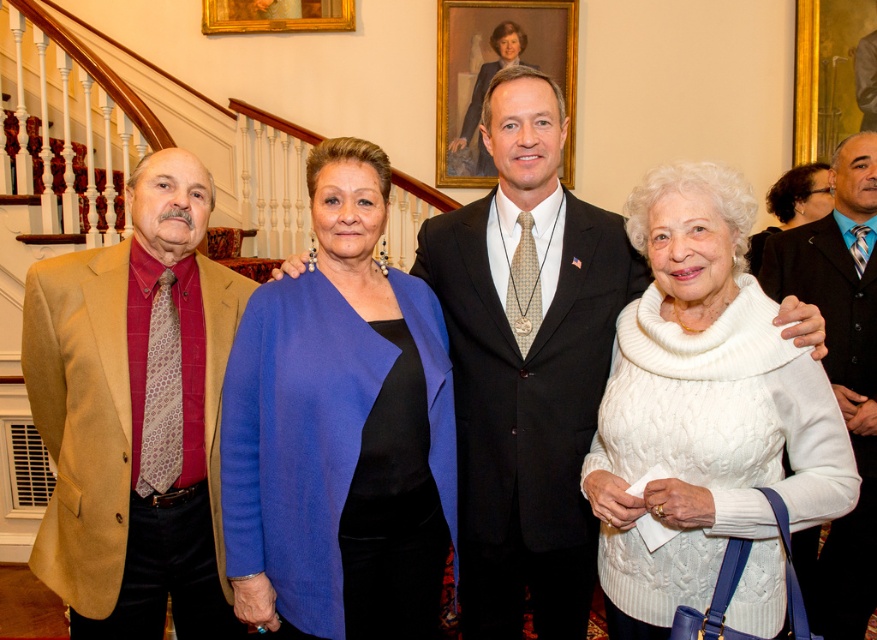
You are a photographer adjusting the camera settings for the group photo. You need to ensure that both the goldwooden frame at upper center and the black shiny hair at upper right are in focus. Which object should you prioritize focusing on first to ensure proper depth of field?

The goldwooden frame at upper center should be prioritized for focus first because its larger width compared to the black shiny hair at upper right requires more attention to capture details properly.